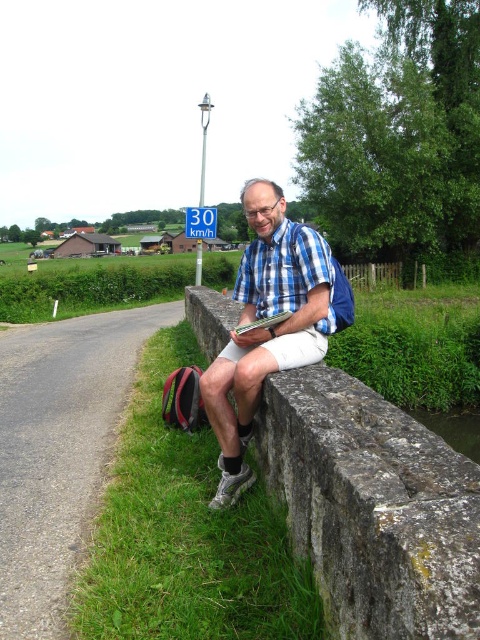
Question: Is blue plaid shirt at center wider than blue plastic speed limit sign at upper center?

Choices:
 (A) no
 (B) yes

Answer: (A)

Question: Does stone at center come in front of green grass at lower left?

Choices:
 (A) yes
 (B) no

Answer: (A)

Question: Which point appears closest to the camera in this image?

Choices:
 (A) (294, 236)
 (B) (239, 328)
 (C) (267, 600)

Answer: (C)

Question: Can you confirm if green grass at lower left is smaller than blue plaid shirt at center?

Choices:
 (A) yes
 (B) no

Answer: (A)

Question: Which point is farther from the camera taking this photo?

Choices:
 (A) (453, 616)
 (B) (253, 289)

Answer: (B)

Question: Based on their relative distances, which object is farther from the blue checkered shirt at center?

Choices:
 (A) blue plastic speed limit sign at upper center
 (B) green grass at lower left
 (C) stone at center
 (D) blue plaid shirt at center

Answer: (A)